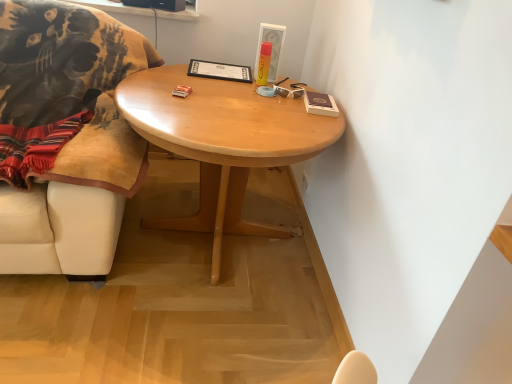
Question: Is point (275, 72) closer or farther from the camera than point (162, 97)?

Choices:
 (A) closer
 (B) farther

Answer: (B)

Question: Considering the positions of matte white picture frame at upper center and light wood/finish coffee table at center in the image, is matte white picture frame at upper center wider or thinner than light wood/finish coffee table at center?

Choices:
 (A) wide
 (B) thin

Answer: (B)

Question: Estimate the real-world distances between objects in this image. Which object is farther from the velvet beige chair at left?

Choices:
 (A) matte white picture frame at upper center
 (B) light wood/finish coffee table at center
 (C) white plastic sunglasses at upper right

Answer: (C)

Question: Considering the real-world distances, which object is farthest from the matte white picture frame at upper center?

Choices:
 (A) light wood/finish coffee table at center
 (B) velvet beige chair at left
 (C) white plastic sunglasses at upper right

Answer: (B)